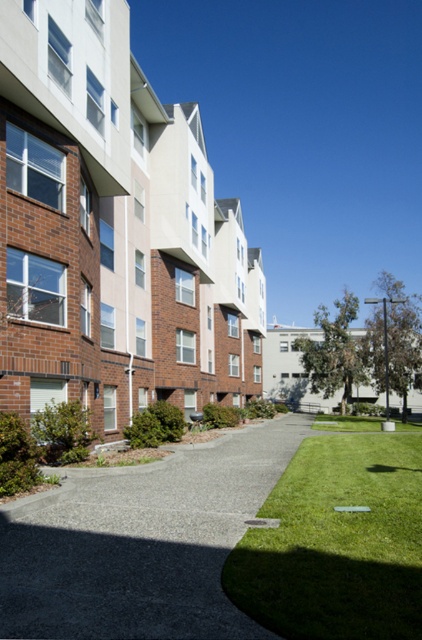
You are a delivery person trying to deliver a package to the residential complex. You notice the gray concrete path at center and the green grass at center. Which surface should you avoid stepping on to prevent tripping due to height differences?

You should avoid stepping on the green grass at center because it is higher than the gray concrete path at center, which could cause tripping hazards.